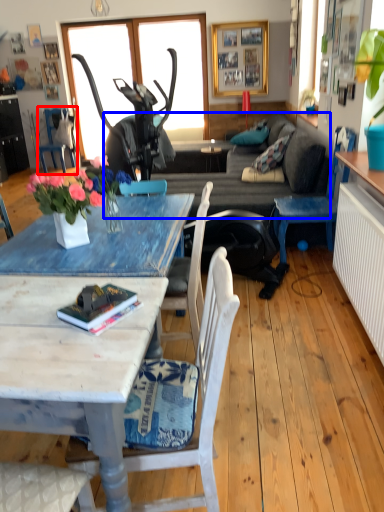
Question: Among these objects, which one is nearest to the camera, chair (highlighted by a red box) or studio couch (highlighted by a blue box)?

Choices:
 (A) chair
 (B) studio couch

Answer: (B)